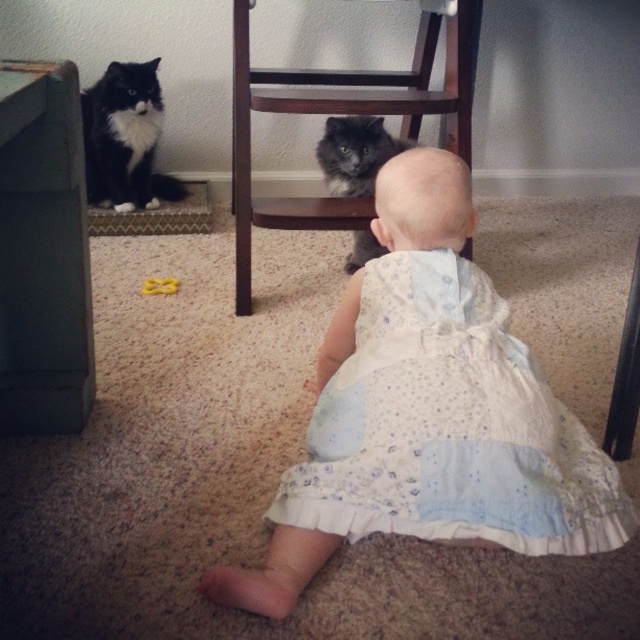
You are a parent trying to place a 10 inch long toy between the wooden chair at center and the fluffy gray cat at center. Can the toy fit in the space between them?

The distance between the wooden chair at center and the fluffy gray cat at center is 6.80 inches. Since the toy is 10 inches long, it cannot fit in the space between them because the space is narrower than the toy.

You are a photographer trying to capture a closeup of the white dotted fabric dress at center. Your camera has a minimum focusing distance of 30 inches. Can you take the photo without moving the dress?

The white dotted fabric dress at center and camera are 32.99 inches apart, so yes, the photographer can take the photo since the distance is within the camera minimum focusing distance of 30 inches.

You are a parent trying to ensure the baby is safe while playing with the cats. The baby is sitting on the beige carpeted floor facing the two cats. Which object between the wooden chair at center and the fluffy gray cat at center is larger and could potentially block the baby from reaching the other cat?

The wooden chair at center is bigger than the fluffy gray cat at center, so the wooden chair at center is larger and could potentially block the baby from reaching the other cat.